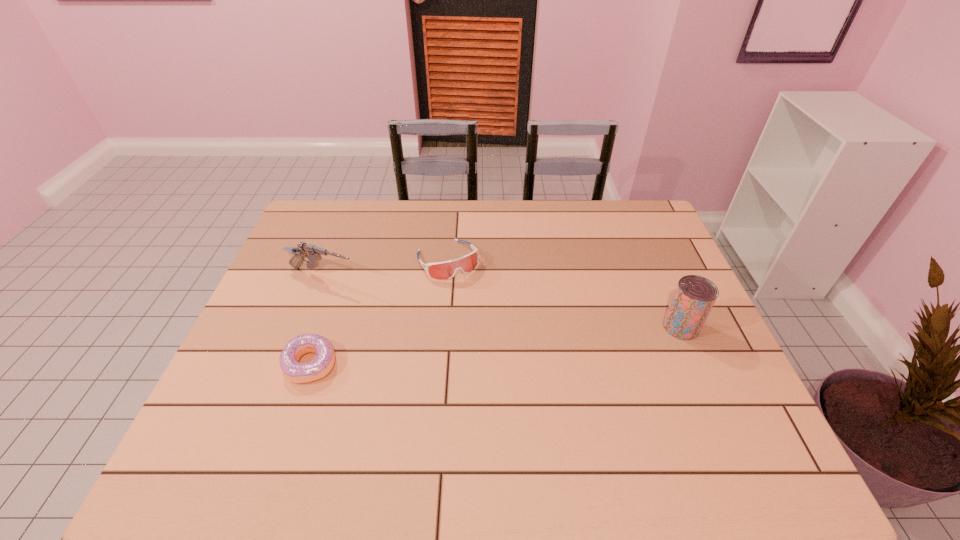
Where is `free space on the desktop that is between the doughnut and the second nearest object and is positioned at the barrel of the third shortest object`? free space on the desktop that is between the doughnut and the second nearest object and is positioned at the barrel of the third shortest object is located at coordinates (523, 343).

The image size is (960, 540). Find the location of `free space on the desktop that is between the doughnut and the beer can and is positioned on the front-facing side of the third object from left to right`. free space on the desktop that is between the doughnut and the beer can and is positioned on the front-facing side of the third object from left to right is located at coordinates (501, 345).